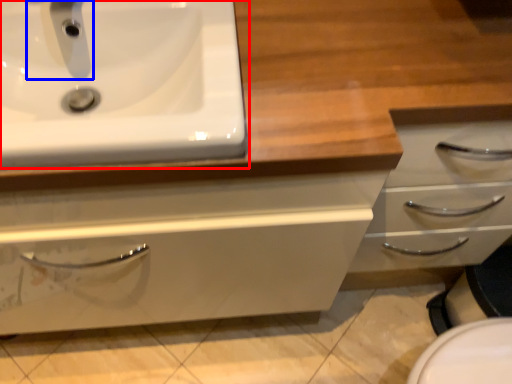
Question: Which of the following is the farthest to the observer, sink (highlighted by a red box) or plumbing fixture (highlighted by a blue box)?

Choices:
 (A) sink
 (B) plumbing fixture

Answer: (B)